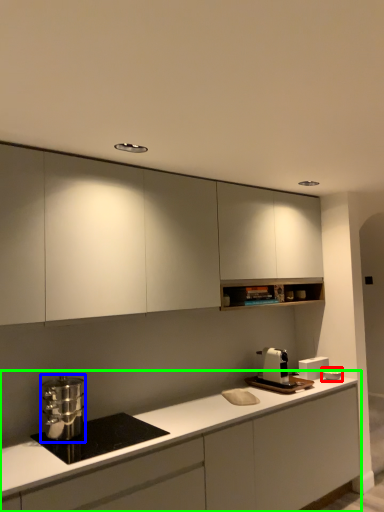
Question: Considering the real-world distances, which object is closest to appliance (highlighted by a red box)? kitchen appliance (highlighted by a blue box) or cabinetry (highlighted by a green box).

Choices:
 (A) kitchen appliance
 (B) cabinetry

Answer: (B)